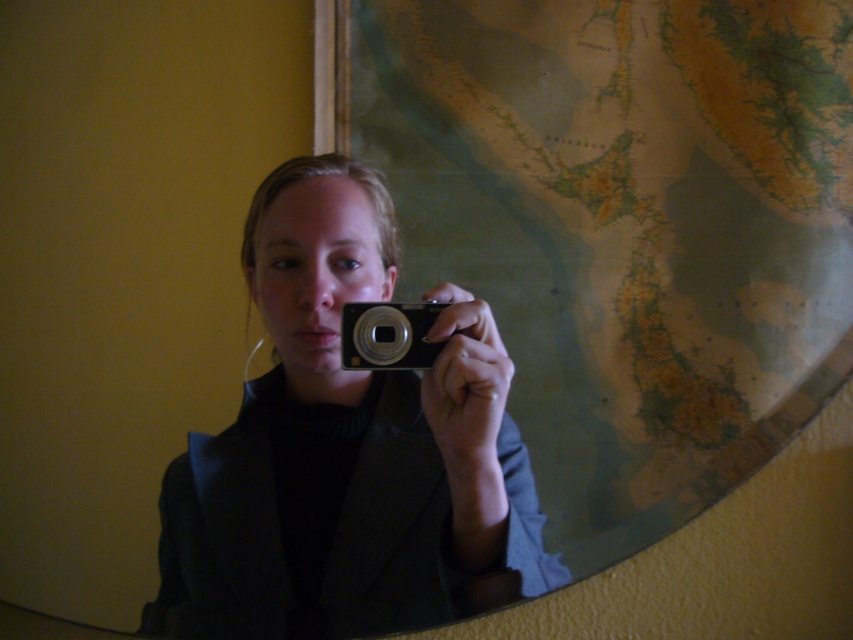
Can you confirm if matte black camera at center is smaller than silver metallic camera at center?

No.

What do you see at coordinates (347, 449) in the screenshot? The height and width of the screenshot is (640, 853). I see `matte black camera at center` at bounding box center [347, 449].

In order to click on matte black camera at center in this screenshot , I will do `click(347, 449)`.